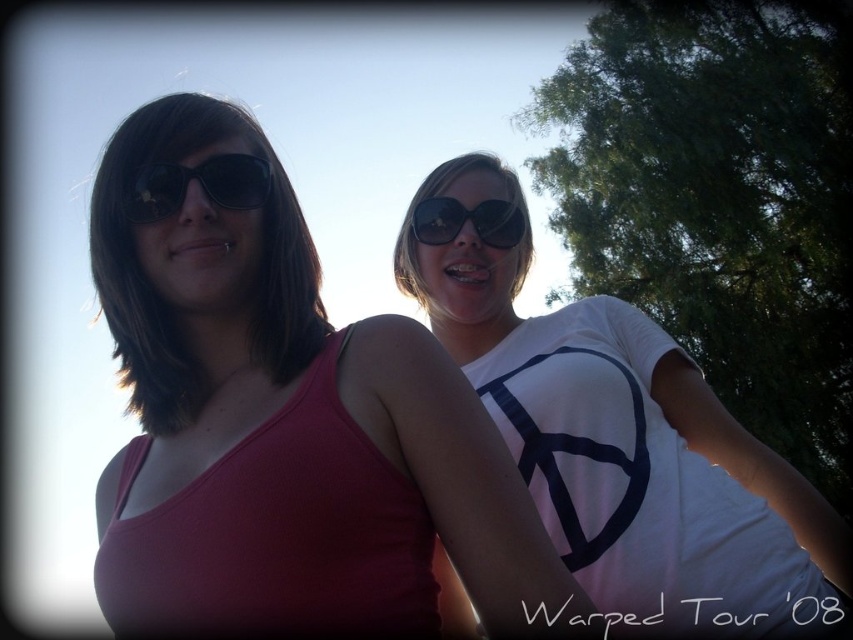
You are a fashion designer who needs to place a matte black tank top at left in a photo shoot. Where should you position it in the image?

The matte black tank top at left should be positioned at point (x=286, y=424).

From the picture: You are standing at point (212,381) and want to walk to the tree in the background. The distance between you and the tree is 10 feet. Can you walk directly to the tree without passing through any people?

The distance between you and the tree is 10 feet, and the distance between you and the viewer is 6.63 feet. Since the viewer is closer to you than the tree, you would need to walk around them to reach the tree without passing through any people.